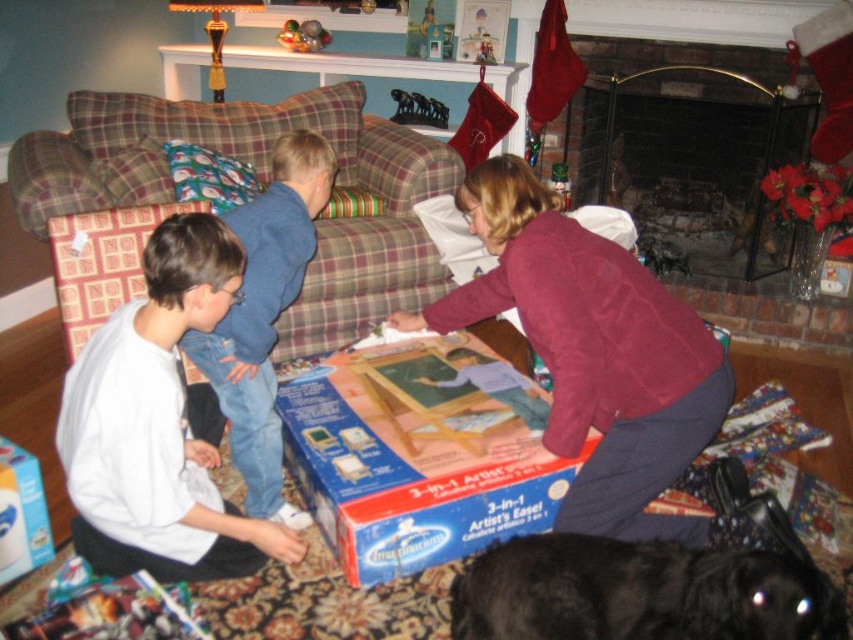
You are a guest at this holiday gathering and want to take a photo of the metallic silver toy at upper center without blocking the white matte shirt at lower left. Is this possible based on their positions?

The white matte shirt at lower left is in front of the metallic silver toy at upper center, so you would need to move the shirt or reposition yourself to ensure the toy is visible without obstruction.